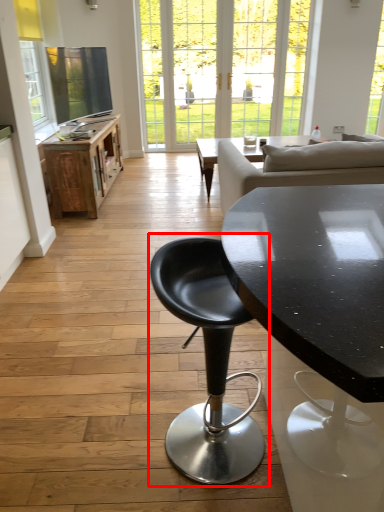
Question: From the image's perspective, where is chair (annotated by the red box) located in relation to table in the image?

Choices:
 (A) below
 (B) above

Answer: (A)